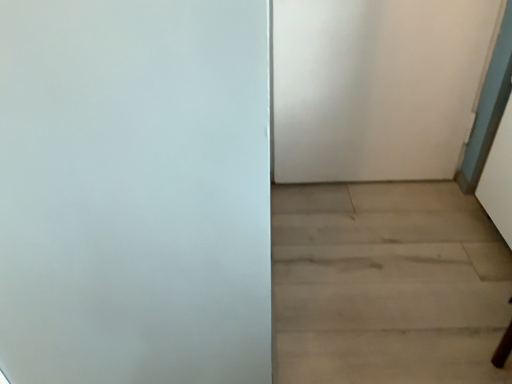
Find the location of a particular element. Image resolution: width=512 pixels, height=384 pixels. light wood floor at lower right is located at coordinates (386, 285).

Image resolution: width=512 pixels, height=384 pixels. What do you see at coordinates (386, 285) in the screenshot?
I see `light wood floor at lower right` at bounding box center [386, 285].

The width and height of the screenshot is (512, 384). Find the location of `white matte door at upper right`. white matte door at upper right is located at coordinates (377, 86).

Describe the element at coordinates (377, 86) in the screenshot. I see `white matte door at upper right` at that location.

Image resolution: width=512 pixels, height=384 pixels. What are the coordinates of `light wood floor at lower right` in the screenshot? It's located at tap(386, 285).

Visually, is white matte door at upper right positioned to the left or to the right of light wood floor at lower right?

Based on their positions, white matte door at upper right is located to the left of light wood floor at lower right.

Considering the positions of objects white matte door at upper right and light wood floor at lower right in the image provided, who is behind, white matte door at upper right or light wood floor at lower right?

white matte door at upper right is further from the camera.

Is point (378, 6) positioned after point (434, 316)?

Yes, point (378, 6) is behind point (434, 316).

From the image's perspective, is white matte door at upper right below light wood floor at lower right?

No, from the image's perspective, white matte door at upper right is not below light wood floor at lower right.

From a real-world perspective, is white matte door at upper right under light wood floor at lower right?

No, from a real-world perspective, white matte door at upper right is not below light wood floor at lower right.

Between white matte door at upper right and light wood floor at lower right, which one has larger width?

light wood floor at lower right is wider.

From the picture: From their relative heights in the image, would you say white matte door at upper right is taller or shorter than light wood floor at lower right?

Clearly, white matte door at upper right is taller compared to light wood floor at lower right.

Which of these two, white matte door at upper right or light wood floor at lower right, is smaller?

light wood floor at lower right.

Is white matte door at upper right inside the boundaries of light wood floor at lower right, or outside?

The correct answer is: outside.

Is white matte door at upper right not close to light wood floor at lower right?

They are positioned close to each other.

Is white matte door at upper right positioned with its back to light wood floor at lower right?

No, white matte door at upper right's orientation is not away from light wood floor at lower right.

Identify the location of door that appears above the light wood floor at lower right (from a real-world perspective). (377, 86).

Considering the relative positions of light wood floor at lower right and white matte door at upper right in the image provided, is light wood floor at lower right to the left of white matte door at upper right from the viewer's perspective?

In fact, light wood floor at lower right is to the right of white matte door at upper right.

Considering the relative positions of light wood floor at lower right and white matte door at upper right in the image provided, is light wood floor at lower right in front of white matte door at upper right?

That is True.

Does point (303, 349) lie behind point (441, 128)?

No, it is in front of (441, 128).

From the image's perspective, who appears lower, light wood floor at lower right or white matte door at upper right?

From the image's view, light wood floor at lower right is below.

From a real-world perspective, is light wood floor at lower right positioned under white matte door at upper right based on gravity?

Indeed, from a real-world perspective, light wood floor at lower right is positioned beneath white matte door at upper right.

Between light wood floor at lower right and white matte door at upper right, which one has smaller width?

Thinner between the two is white matte door at upper right.

Considering the sizes of light wood floor at lower right and white matte door at upper right in the image, is light wood floor at lower right taller or shorter than white matte door at upper right?

In the image, light wood floor at lower right appears to be shorter than white matte door at upper right.

Between light wood floor at lower right and white matte door at upper right, which one has smaller size?

light wood floor at lower right is smaller.

Would you say light wood floor at lower right is outside white matte door at upper right?

That's correct, light wood floor at lower right is outside of white matte door at upper right.

Can you see light wood floor at lower right touching white matte door at upper right?

light wood floor at lower right and white matte door at upper right are not in contact.

Is white matte door at upper right at the back of light wood floor at lower right?

That's not correct — light wood floor at lower right is not looking away from white matte door at upper right.

How different are the orientations of light wood floor at lower right and white matte door at upper right in degrees?

light wood floor at lower right and white matte door at upper right are facing 89.7 degrees away from each other.

Identify the location of door on the left of light wood floor at lower right. This screenshot has width=512, height=384. (377, 86).

Where is `stairwell below the white matte door at upper right (from the image's perspective)`? The height and width of the screenshot is (384, 512). stairwell below the white matte door at upper right (from the image's perspective) is located at coordinates (386, 285).

The width and height of the screenshot is (512, 384). I want to click on stairwell beneath the white matte door at upper right (from a real-world perspective), so click(386, 285).